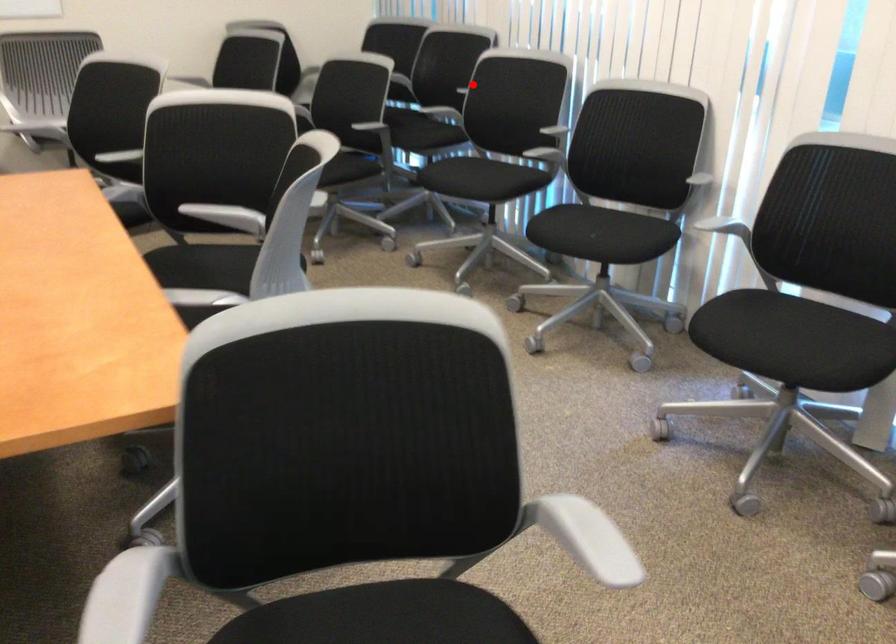
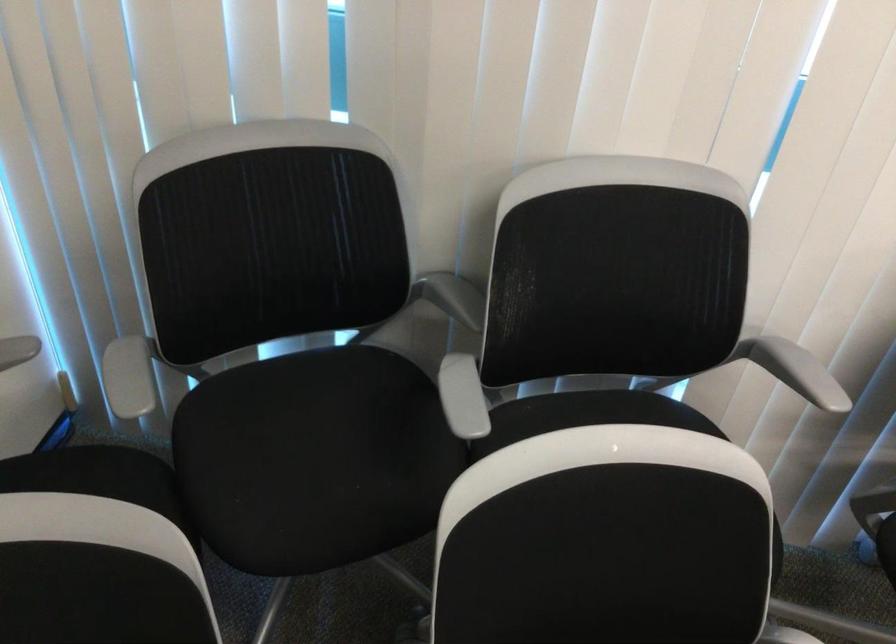
Question: I am providing you with two images of the same scene from different viewpoints. In image1, a red point is highlighted. Considering the same 3D point in image2, which of the following is correct?

Choices:
 (A) It is closer
 (B) It is farther

Answer: (A)